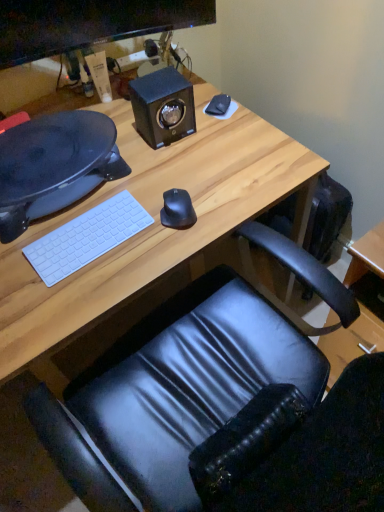
The width and height of the screenshot is (384, 512). I want to click on free space above black glossy speaker at left (from a real-world perspective), so click(47, 148).